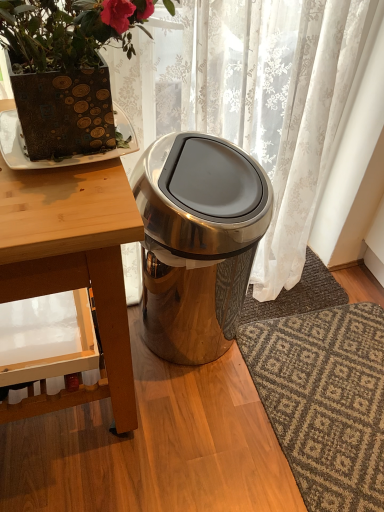
Where is `free point to the left of brown textured rug at lower right, the first doormat positioned from the bottom`? This screenshot has width=384, height=512. free point to the left of brown textured rug at lower right, the first doormat positioned from the bottom is located at coordinates coord(186,423).